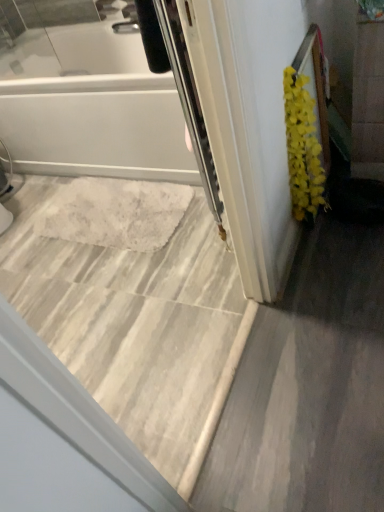
Question: In the image, is white glossy bathtub at upper left on the left side or the right side of marble tile floor at center?

Choices:
 (A) left
 (B) right

Answer: (B)

Question: Choose the correct answer: Is white glossy bathtub at upper left inside marble tile floor at center or outside it?

Choices:
 (A) inside
 (B) outside

Answer: (B)

Question: Which of these objects is positioned closest to the yellow fluffy plant at right?

Choices:
 (A) marble tile floor at center
 (B) white glossy bathtub at upper left

Answer: (A)

Question: Which of these objects is positioned farthest from the white glossy bathtub at upper left?

Choices:
 (A) yellow fluffy plant at right
 (B) marble tile floor at center

Answer: (A)